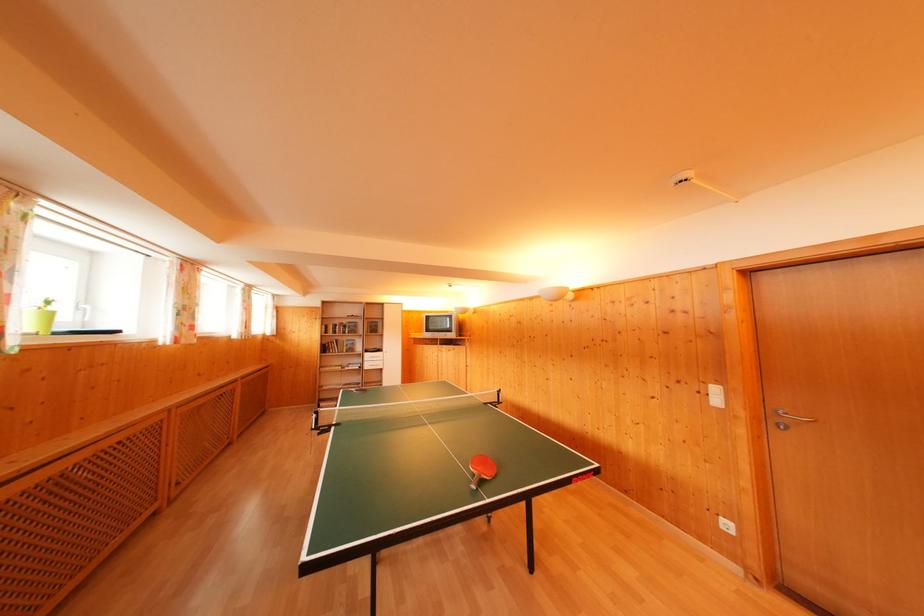
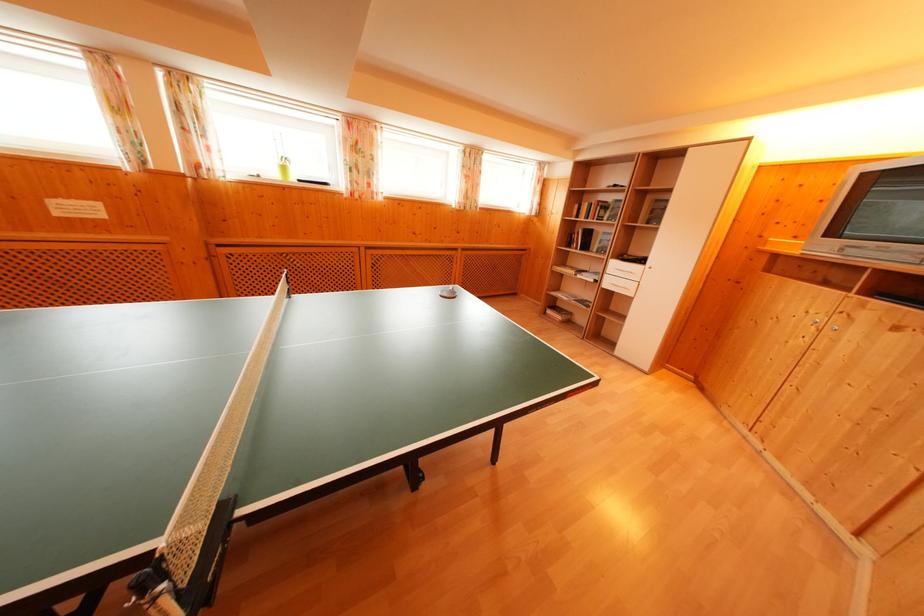
Find the pixel in the second image that matches the point at 371,363 in the first image.

(614, 276)